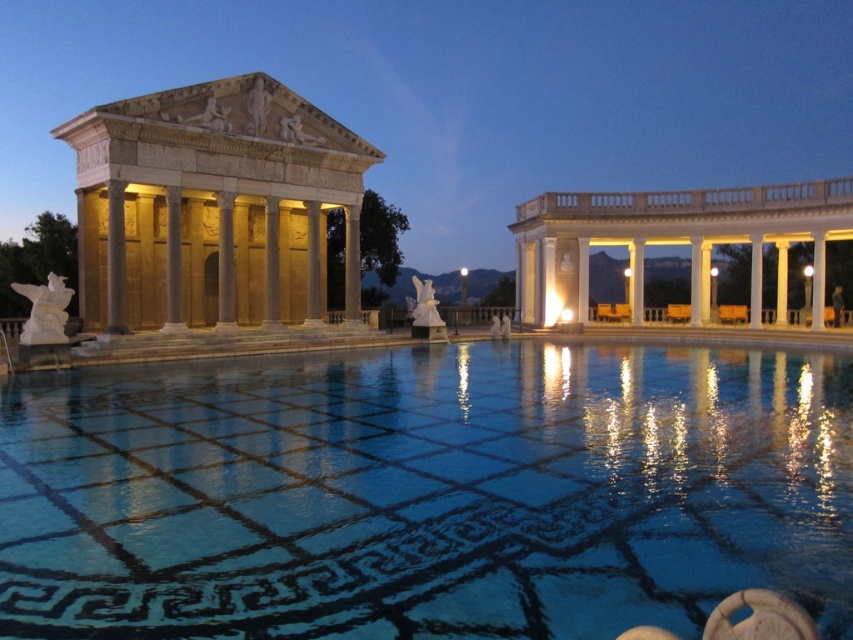
In the scene shown: You are an architect examining the design of the pool area. The blue glossy water at center and white marble columns at right are key elements. Which element is positioned lower in the scene?

The blue glossy water at center is located below white marble columns at right, so it is positioned lower in the scene.

Based on the coordinates provided, what is the main architectural feature located at point (212, 205) in the image?

The point (212, 205) marks the light beige stone temple at left.